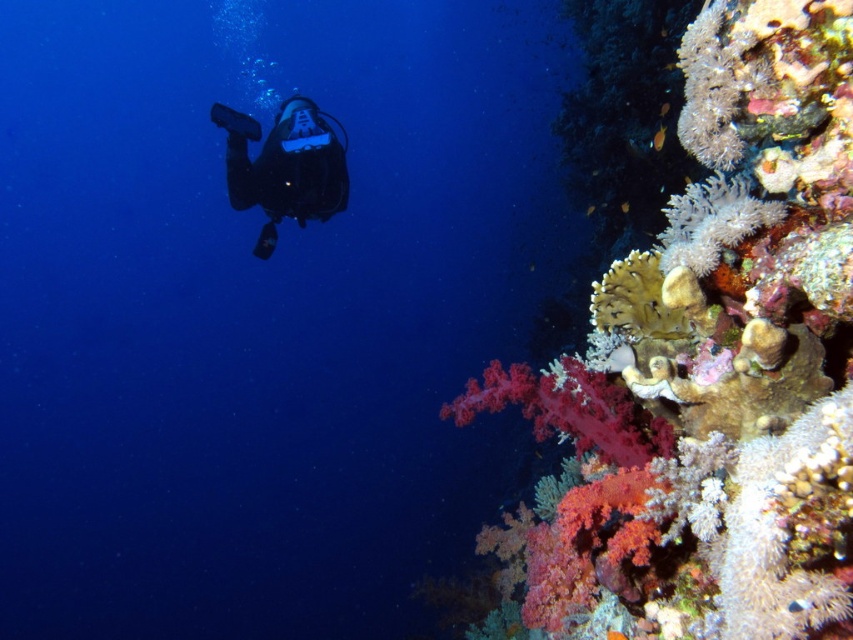
You are a marine biologist studying underwater landmarks. You need to locate the point with coordinates (712, 365) in the image. Based on the scene description, where would this point be located?

The point with coordinates (712, 365) is located on the soft coral at upper right.

You are a marine biologist observing an underwater scene. You see the soft coral at upper right and the white fluffy coral at right. Which coral is positioned closer to you?

The soft coral at upper right is closer to the viewer than the white fluffy coral at right.